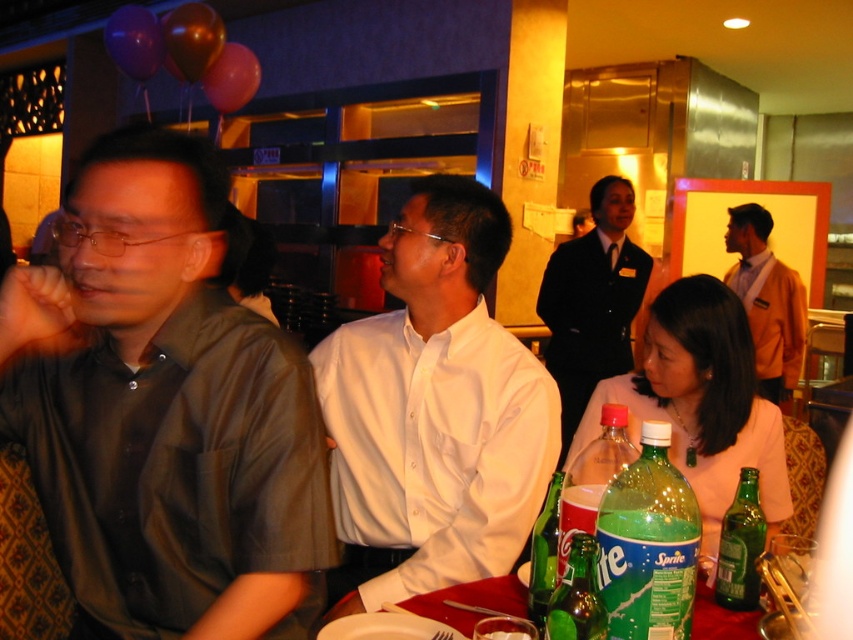
Question: Observing the image, what is the correct spatial positioning of green plastic bottle at lower right in reference to shiny purple balloon at upper left?

Choices:
 (A) below
 (B) above

Answer: (A)

Question: Estimate the real-world distances between objects in this image. Which object is closer to the white smooth shirt at center?

Choices:
 (A) orange fabric shirt at right
 (B) green plastic bottle at center
 (C) green plastic bottle at lower right
 (D) pink fabric at lower right

Answer: (B)

Question: Is dark green shirt at left thinner than green glass bottle at lower center?

Choices:
 (A) yes
 (B) no

Answer: (B)

Question: Which of these objects is positioned farthest from the white shirt at center?

Choices:
 (A) green glass bottle at lower center
 (B) shiny dark red balloon at upper left

Answer: (A)

Question: Which object appears closest to the camera in this image?

Choices:
 (A) shiny purple balloon at upper left
 (B) orange fabric shirt at right

Answer: (B)

Question: Is shiny purple balloon at upper left to the right of rubberized red balloon at upper left from the viewer's perspective?

Choices:
 (A) yes
 (B) no

Answer: (B)